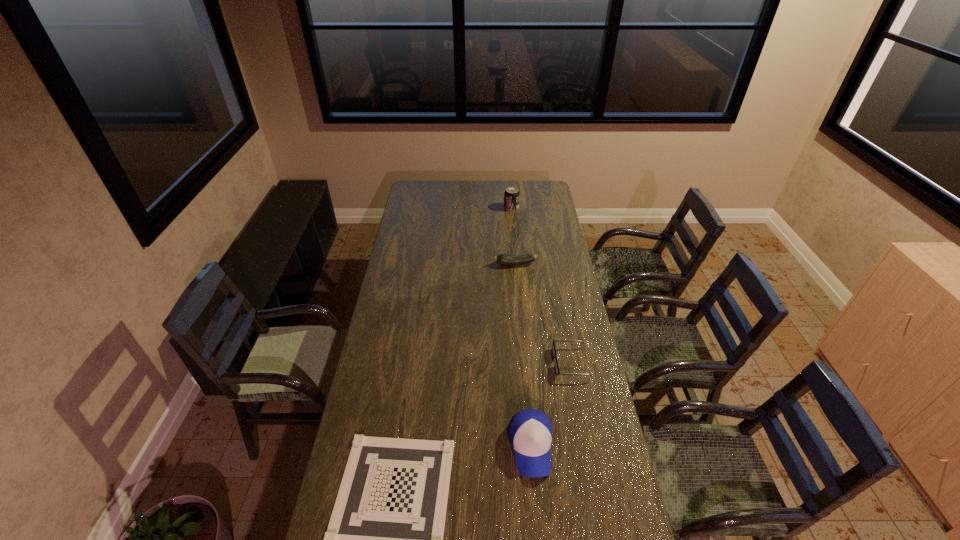
Image resolution: width=960 pixels, height=540 pixels. I want to click on vacant space at the far right corner of the desktop, so click(535, 183).

Where is `vacant region between the third shortest object and the second shortest object`? This screenshot has width=960, height=540. vacant region between the third shortest object and the second shortest object is located at coordinates (543, 313).

Image resolution: width=960 pixels, height=540 pixels. I want to click on empty space that is in between the third farthest object and the fourth shortest object, so click(551, 404).

Identify the location of blank region between the fourth nearest object and the fourth tallest object. Image resolution: width=960 pixels, height=540 pixels. (543, 313).

I want to click on free point between the fourth tallest object and the zucchini, so click(x=543, y=313).

Find the location of a particular element. vacant space that's between the tallest object and the fourth shortest object is located at coordinates (521, 327).

Find the location of a particular element. The width and height of the screenshot is (960, 540). free space between the spectacles and the soda can is located at coordinates (540, 285).

I want to click on the second closest object relative to the fourth shortest object, so click(x=385, y=537).

Identify which object is the fourth closest to the spectacles. Please provide its 2D coordinates. Your answer should be formatted as a tuple, i.e. [(x, y)], where the tuple contains the x and y coordinates of a point satisfying the conditions above.

[(511, 196)]

Where is `free space that satisfies the following two spatial constraints: 1. at the blossom end of the zucchini; 2. on the front-facing side of the baseball cap`? This screenshot has height=540, width=960. free space that satisfies the following two spatial constraints: 1. at the blossom end of the zucchini; 2. on the front-facing side of the baseball cap is located at coordinates (533, 447).